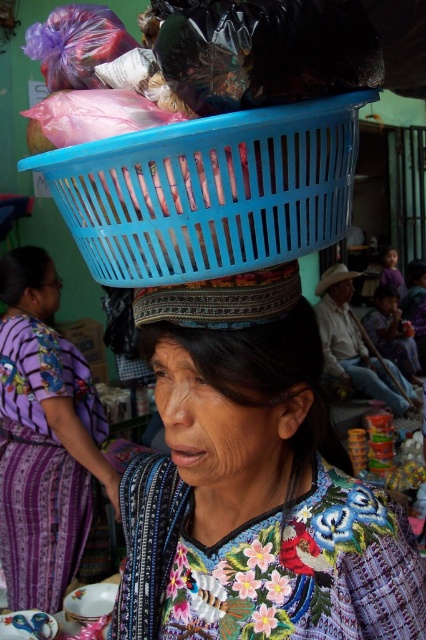
Question: Observing the image, what is the correct spatial positioning of dark brown woven hat at center in reference to smooth skin head at center?

Choices:
 (A) right
 (B) left

Answer: (A)

Question: Where is dark brown woven hat at center located in relation to smooth skin head at center in the image?

Choices:
 (A) above
 (B) below

Answer: (B)

Question: Which object is positioned farthest from the embroidered fabric dress at center?

Choices:
 (A) matte purple dress at lower left
 (B) embroidered fabric at center
 (C) blue plastic basket at center

Answer: (C)

Question: Which point is farther from the camera taking this photo?

Choices:
 (A) (80, 420)
 (B) (192, 355)

Answer: (A)

Question: Which object is closer to the camera taking this photo?

Choices:
 (A) textured fabric headscarf at center
 (B) blue plastic basket at center

Answer: (B)

Question: Is embroidered fabric at center further to the viewer compared to blue plastic basket at center?

Choices:
 (A) yes
 (B) no

Answer: (A)